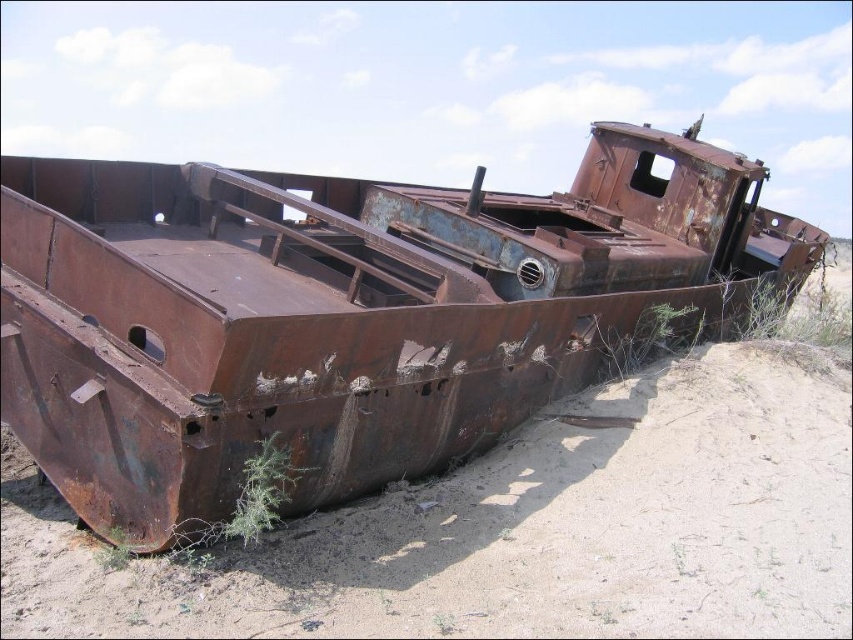
What do you see at coordinates (338, 312) in the screenshot?
I see `rusty metal boat at center` at bounding box center [338, 312].

I want to click on rusty metal boat at center, so click(x=338, y=312).

You are a GUI agent. You are given a task and a screenshot of the screen. Output one action in this format:
    pyautogui.click(x=<x>, y=<y>)
    Task: Click on the rusty metal boat at center
    
    Given the screenshot: What is the action you would take?
    pyautogui.click(x=338, y=312)

Is rusty metal boat at center wider than green leafy plant at lower right?

In fact, rusty metal boat at center might be narrower than green leafy plant at lower right.

Where is `rusty metal boat at center`? Image resolution: width=853 pixels, height=640 pixels. rusty metal boat at center is located at coordinates (338, 312).

Which is in front, point (531, 298) or point (245, 520)?

Point (245, 520) is in front.

Which is more to the right, rusty metal boat at center or green fuzzy plant at lower center?

rusty metal boat at center is more to the right.

Is point (467, 300) farther from viewer compared to point (271, 529)?

Yes, it is.

Locate an element on the screen. rusty metal boat at center is located at coordinates (338, 312).